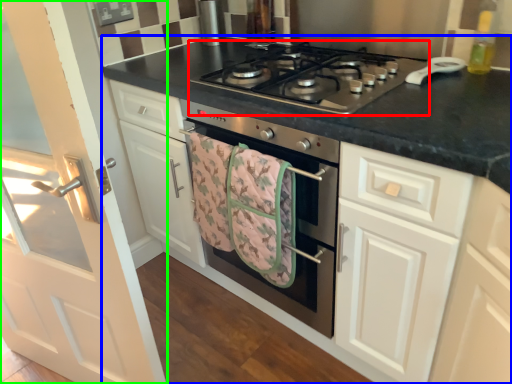
Question: Which object is positioned closest to gas stove (highlighted by a red box)? Select from countertop (highlighted by a blue box) and door (highlighted by a green box).

Choices:
 (A) countertop
 (B) door

Answer: (A)